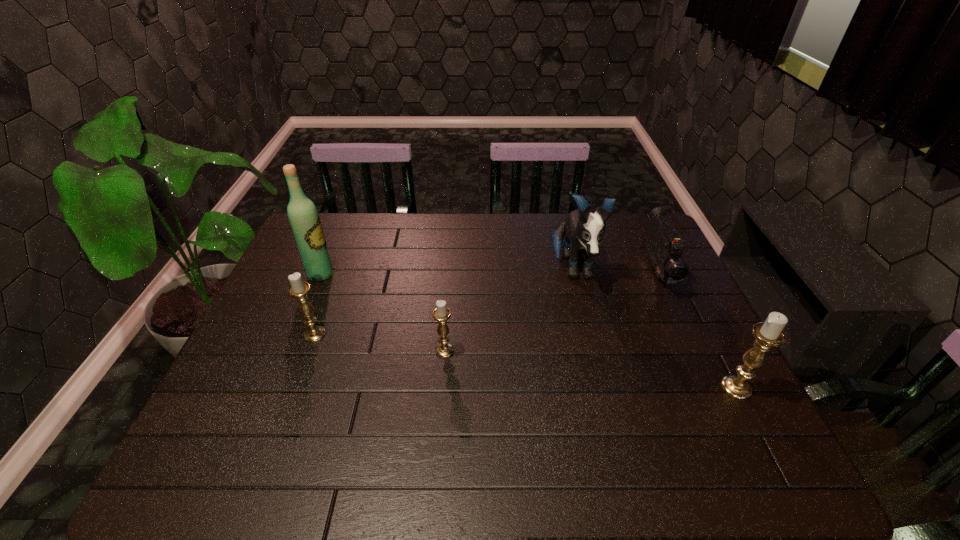
Locate an element on the screen. blank space at the far right corner is located at coordinates (613, 229).

Find the location of a particular element. Image resolution: width=960 pixels, height=540 pixels. free space at the near right corner of the desktop is located at coordinates pos(693,400).

This screenshot has width=960, height=540. Find the location of `vacant space that's between the third object from left to right and the wine bottle`. vacant space that's between the third object from left to right and the wine bottle is located at coordinates (383, 313).

This screenshot has width=960, height=540. What are the coordinates of `unoccupied area between the nearest candle holder and the wine bottle` in the screenshot? It's located at (529, 331).

Identify the location of free spot between the puppy and the camcorder. This screenshot has height=540, width=960. (615, 271).

Image resolution: width=960 pixels, height=540 pixels. Find the location of `empty space that is in between the nearest object and the fourth tallest object`. empty space that is in between the nearest object and the fourth tallest object is located at coordinates (525, 361).

This screenshot has height=540, width=960. Identify the location of vacant area between the second candle holder from right to left and the camcorder. (551, 312).

I want to click on vacant area that lies between the nearest candle holder and the third object from left to right, so click(x=590, y=369).

I want to click on free area in between the camcorder and the nearest object, so click(697, 330).

This screenshot has height=540, width=960. In order to click on free space between the wine bottle and the second nearest object in this screenshot , I will do `click(383, 313)`.